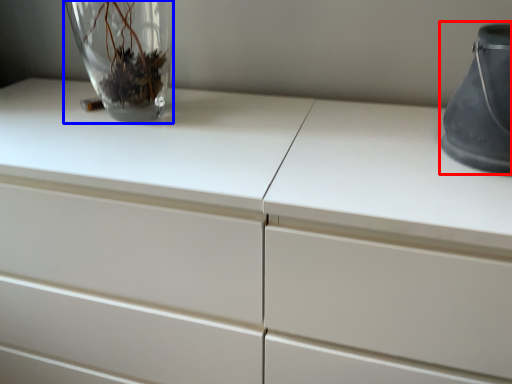
Question: Which of the following is the closest to the observer, vase (highlighted by a red box) or vase (highlighted by a blue box)?

Choices:
 (A) vase
 (B) vase

Answer: (A)